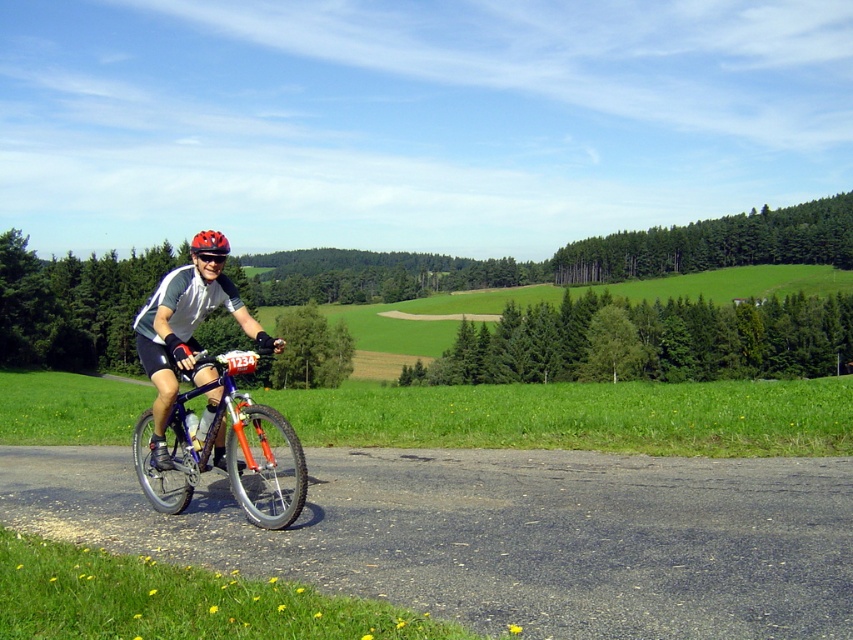
Question: Can you confirm if shiny blue frame at center is positioned to the right of orange matte bicycle helmet at upper center?

Choices:
 (A) no
 (B) yes

Answer: (B)

Question: Is shiny blue frame at center to the right of orange matte bicycle helmet at upper center from the viewer's perspective?

Choices:
 (A) yes
 (B) no

Answer: (A)

Question: Which point is farther from the camera taking this photo?

Choices:
 (A) (x=149, y=413)
 (B) (x=212, y=244)

Answer: (A)

Question: Which object is closer to the camera taking this photo?

Choices:
 (A) orange matte bicycle helmet at upper center
 (B) shiny blue frame at center

Answer: (B)

Question: Can you confirm if shiny blue frame at center is smaller than orange matte bicycle helmet at upper center?

Choices:
 (A) no
 (B) yes

Answer: (B)